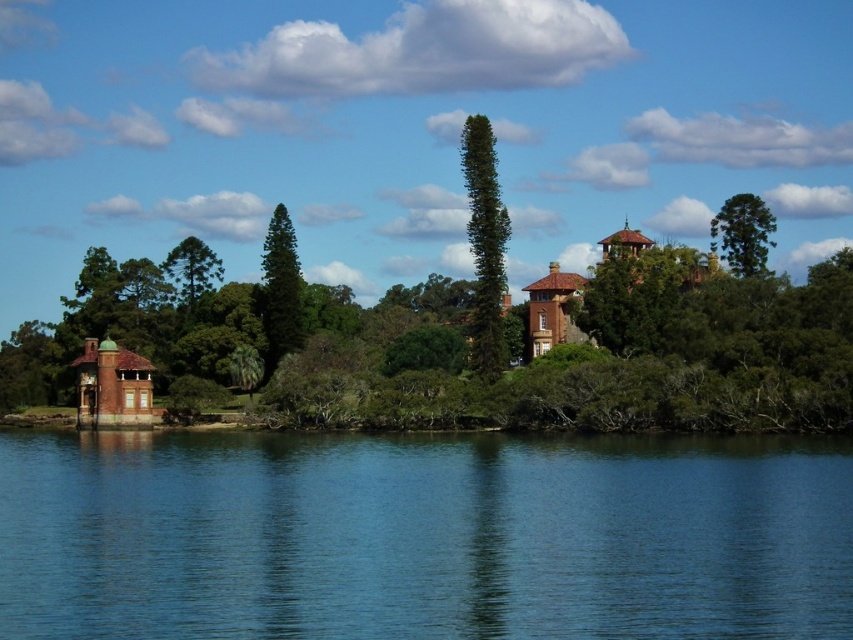
Does point (268, 250) come in front of point (762, 225)?

No, it is behind (762, 225).

Which is below, green glossy tree at center or green textured tree at upper right?

green glossy tree at center is lower down.

Which is behind, point (281, 205) or point (712, 236)?

Point (281, 205)

Where is `green glossy tree at center`? The height and width of the screenshot is (640, 853). green glossy tree at center is located at coordinates (280, 288).

Is the position of green textured tree at center less distant than that of green textured tree at upper center?

Yes, it is in front of green textured tree at upper center.

Is point (498, 304) positioned after point (190, 241)?

That is False.

Locate an element on the screen. The width and height of the screenshot is (853, 640). green textured tree at center is located at coordinates (485, 244).

Can you confirm if green textured tree at upper right is shorter than green textured tree at upper center?

No, green textured tree at upper right is not shorter than green textured tree at upper center.

Who is more distant from viewer, (763, 218) or (177, 260)?

Point (177, 260)

Describe the element at coordinates (743, 234) in the screenshot. The image size is (853, 640). I see `green textured tree at upper right` at that location.

Image resolution: width=853 pixels, height=640 pixels. Identify the location of green textured tree at upper right. (743, 234).